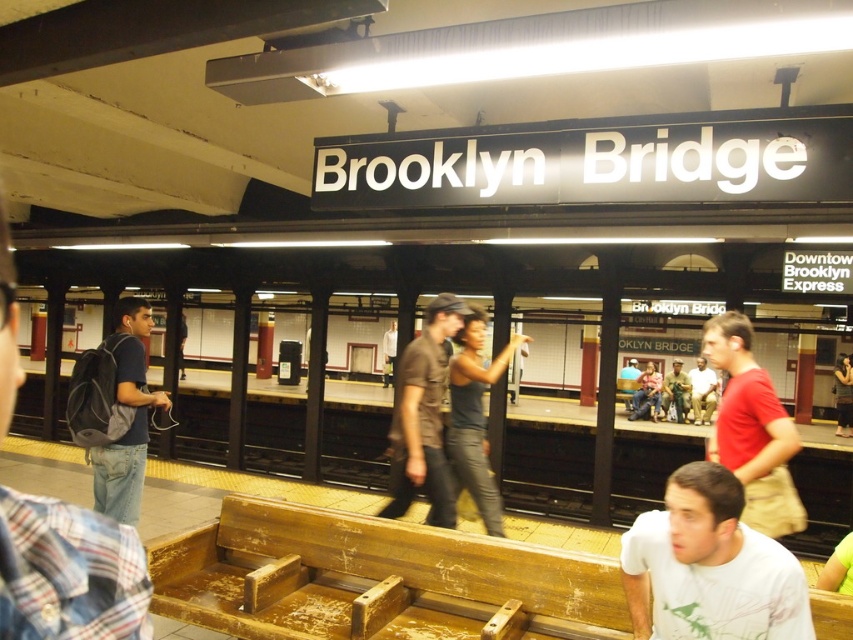
Question: Which point appears closest to the camera in this image?

Choices:
 (A) (117, 488)
 (B) (450, 314)
 (C) (753, 458)

Answer: (C)

Question: Which of the following is the closest to the observer?

Choices:
 (A) red cotton t-shirt at right
 (B) dark blue backpack at left

Answer: (A)

Question: Does red cotton t-shirt at right appear on the right side of light brown leather jacket at center?

Choices:
 (A) no
 (B) yes

Answer: (A)

Question: Can you confirm if white matte shirt at lower right is positioned below dark gray jeans at center?

Choices:
 (A) no
 (B) yes

Answer: (B)

Question: Is dark gray jeans at center positioned in front of light brown leather jacket at center?

Choices:
 (A) yes
 (B) no

Answer: (A)

Question: Which point appears farthest from the camera in this image?

Choices:
 (A) (440, 374)
 (B) (762, 584)
 (C) (480, 381)

Answer: (C)